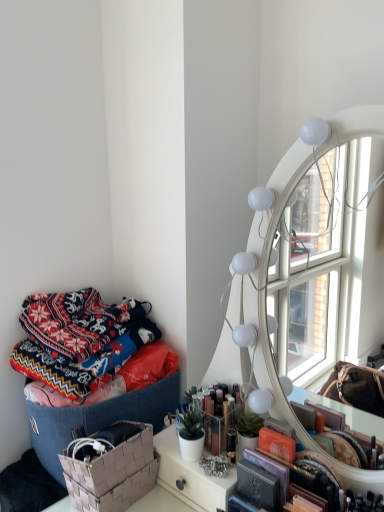
Question: Is textured woven basket at left at the back of beige woven basket at lower left?

Choices:
 (A) yes
 (B) no

Answer: (B)

Question: From a real-world perspective, is beige woven basket at lower left on top of textured woven basket at left?

Choices:
 (A) yes
 (B) no

Answer: (B)

Question: Can you confirm if beige woven basket at lower left is taller than textured woven basket at left?

Choices:
 (A) yes
 (B) no

Answer: (B)

Question: Is there a large distance between beige woven basket at lower left and textured woven basket at left?

Choices:
 (A) yes
 (B) no

Answer: (B)

Question: Does beige woven basket at lower left appear on the left side of textured woven basket at left?

Choices:
 (A) yes
 (B) no

Answer: (B)

Question: From their relative heights in the image, would you say beige woven basket at lower left is taller or shorter than knitted woolen blanket at left?

Choices:
 (A) tall
 (B) short

Answer: (B)

Question: Is beige woven basket at lower left bigger or smaller than knitted woolen blanket at left?

Choices:
 (A) big
 (B) small

Answer: (B)

Question: Is point (112, 437) positioned closer to the camera than point (87, 359)?

Choices:
 (A) closer
 (B) farther

Answer: (A)

Question: Which is correct: beige woven basket at lower left is inside knitted woolen blanket at left, or outside of it?

Choices:
 (A) inside
 (B) outside

Answer: (B)

Question: In terms of width, does textured woven basket at left look wider or thinner when compared to knitted woolen blanket at left?

Choices:
 (A) wide
 (B) thin

Answer: (A)

Question: From a real-world perspective, relative to knitted woolen blanket at left, is textured woven basket at left vertically above or below?

Choices:
 (A) above
 (B) below

Answer: (B)

Question: Looking at the image, does textured woven basket at left seem bigger or smaller compared to knitted woolen blanket at left?

Choices:
 (A) big
 (B) small

Answer: (A)

Question: Considering their positions, is textured woven basket at left located in front of or behind knitted woolen blanket at left?

Choices:
 (A) behind
 (B) front

Answer: (B)

Question: Would you say knitted woolen blanket at left is inside or outside beige woven basket at lower left?

Choices:
 (A) inside
 (B) outside

Answer: (B)

Question: Would you say knitted woolen blanket at left is to the left or to the right of beige woven basket at lower left in the picture?

Choices:
 (A) left
 (B) right

Answer: (A)